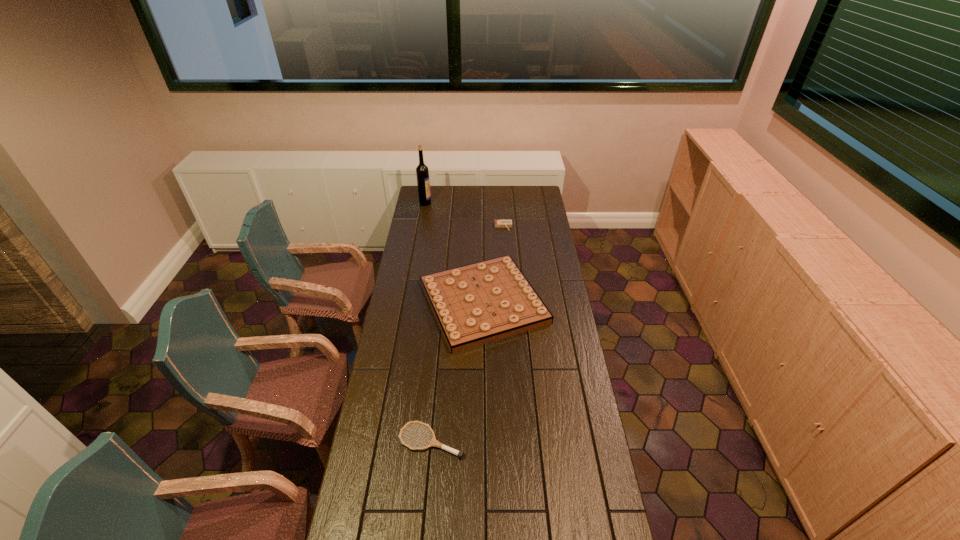
Locate an element on the screen. object situated at the far edge is located at coordinates (422, 172).

What are the coordinates of `wine bottle that is at the left edge` in the screenshot? It's located at (422, 172).

Identify the location of gameboard that is positioned at the left edge. The height and width of the screenshot is (540, 960). pos(475,304).

Where is `tennis racket at the left edge`? tennis racket at the left edge is located at coordinates (433, 442).

Image resolution: width=960 pixels, height=540 pixels. In order to click on object that is at the right edge in this screenshot , I will do `click(475, 304)`.

The height and width of the screenshot is (540, 960). What are the coordinates of `object that is at the far left corner` in the screenshot? It's located at (422, 172).

This screenshot has width=960, height=540. In the image, there is a desktop. Identify the location of free space at the far edge. (446, 185).

Find the location of `free spot at the left edge of the desktop`. free spot at the left edge of the desktop is located at coordinates (423, 242).

Where is `free space at the right edge of the desktop`? This screenshot has width=960, height=540. free space at the right edge of the desktop is located at coordinates (598, 472).

Identify the location of empty location between the wine bottle and the gameboard. (454, 253).